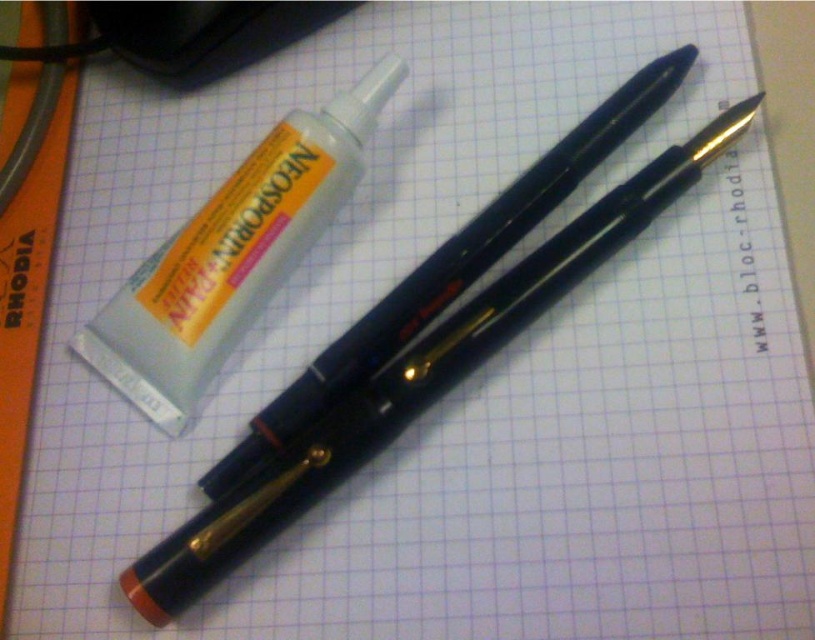
Is white glossy tube at upper left taller than black plastic pen at center?

In fact, white glossy tube at upper left may be shorter than black plastic pen at center.

This screenshot has height=640, width=815. Identify the location of white glossy tube at upper left. [x=232, y=256].

Locate an element on the screen. The width and height of the screenshot is (815, 640). white glossy tube at upper left is located at coordinates (232, 256).